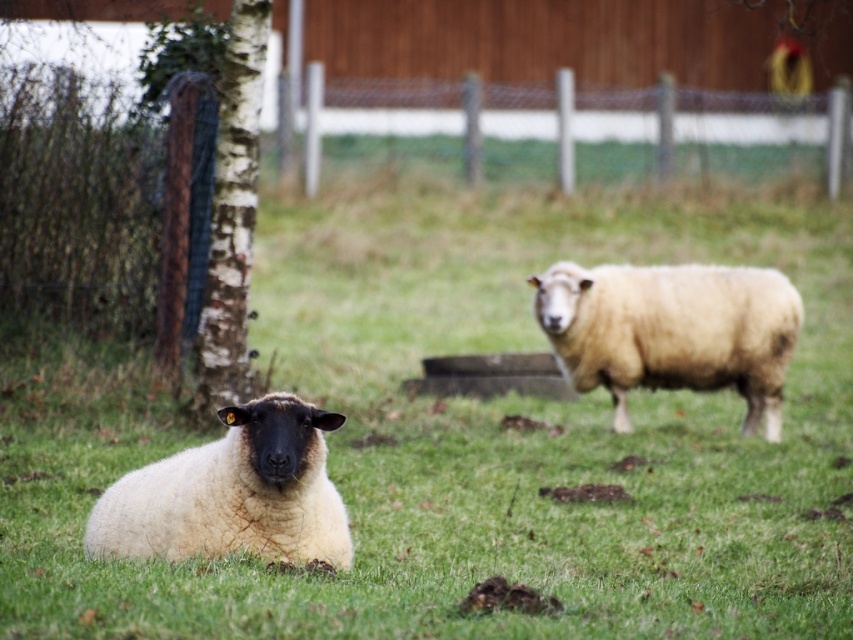
Based on the photo, is white woolly sheep at lower left taller than barky birch tree at left?

No.

Measure the distance between white woolly sheep at lower left and barky birch tree at left.

A: A distance of 5.13 meters exists between white woolly sheep at lower left and barky birch tree at left.

Who is more forward, (271, 468) or (229, 97)?

Positioned in front is point (271, 468).

Where is `white woolly sheep at lower left`? white woolly sheep at lower left is located at coordinates (231, 493).

Who is lower down, green grassy at center or barky birch tree at left?

green grassy at center is lower down.

Is point (386, 588) positioned in front of point (242, 308)?

Yes, it is.

Where is `green grassy at center`? green grassy at center is located at coordinates (469, 436).

Consider the image. Can you confirm if green grassy at center is smaller than white wire mesh at center?

No, green grassy at center is not smaller than white wire mesh at center.

Can you confirm if green grassy at center is taller than white wire mesh at center?

Indeed, green grassy at center has a greater height compared to white wire mesh at center.

The image size is (853, 640). Identify the location of green grassy at center. (469, 436).